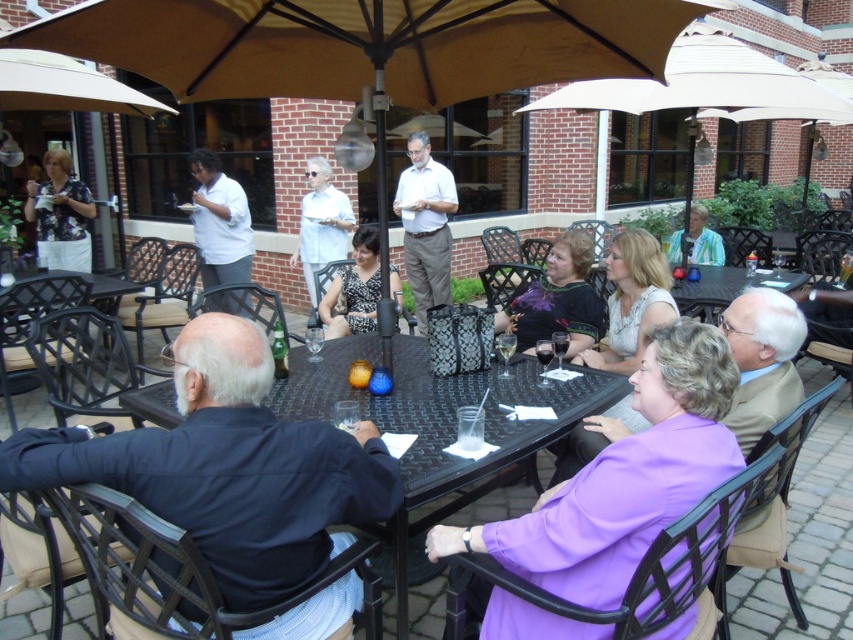
You are a photographer taking a picture of the two diners wearing the dark blue shirt at center and matte white shirt at center. Which shirt should you focus on first if you want to capture them from left to right order?

The matte white shirt at center should be focused on first because the dark blue shirt at center is to the right of it, meaning the matte white shirt at center is positioned to the left.

What object is located at the coordinates point (368, 48) in the image?

The tan fabric umbrella at center is located at point (368, 48).

You are a waiter at the restaurant and need to deliver a drink to the customer sitting under the tan fabric umbrella at center. However, you notice the matte white shirt at center is blocking your path. Which object should you move to reach the customer?

You should move the matte white shirt at center because the tan fabric umbrella at center is positioned on the right side of it, so moving the shirt will clear the path to the umbrella.